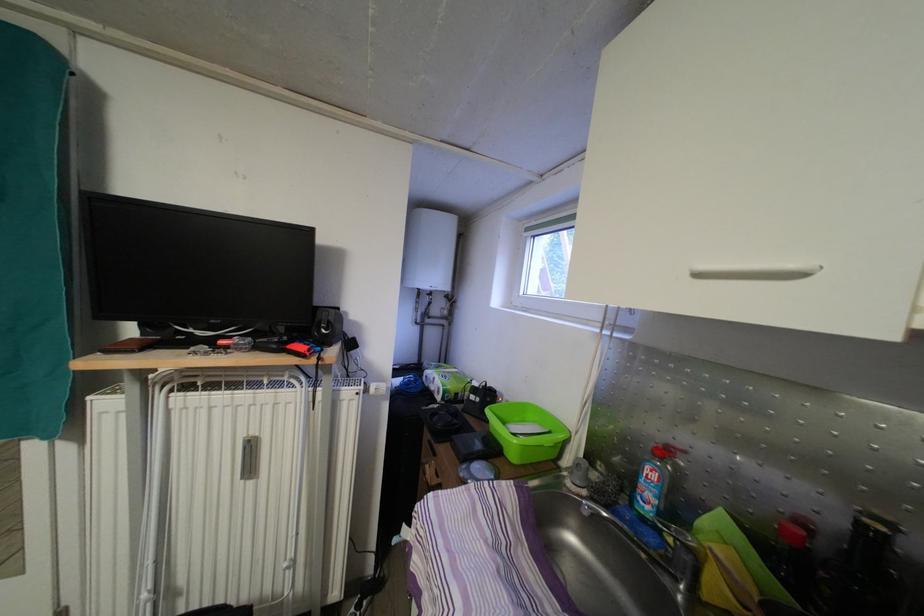
Where would you pull the white cabinet handle? Please return your answer as a coordinate pair (x, y).

(756, 272)